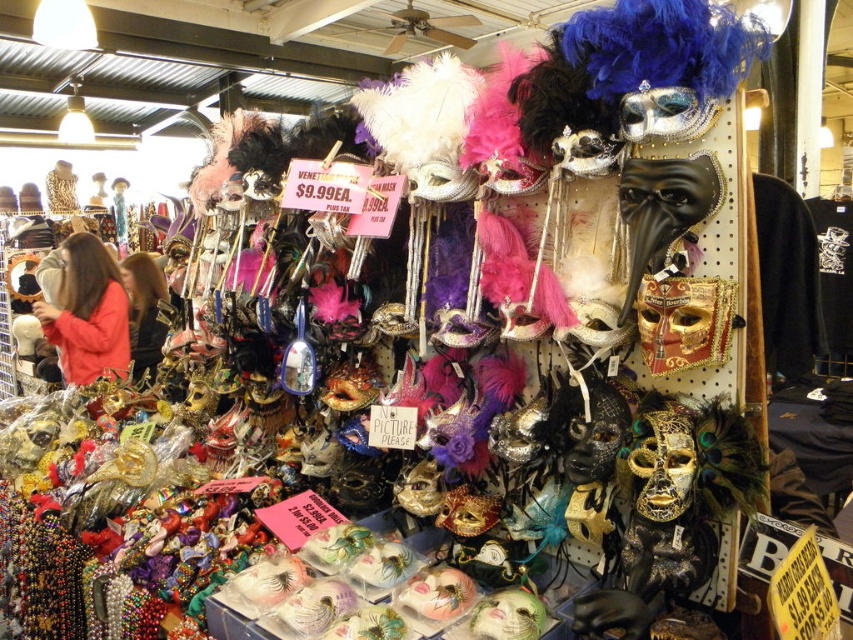
You are a customer at the market stall and want to buy two masks. The first is at point (64, 376) and the second is at point 0.622, 0.112. The stall requires that customers must be within 3 meters of an item to pick it up. Can you pick both items without moving?

The two points are 3.65 meters apart. Since the required distance to pick up an item is within 3 meters, and you can only stay in one place, you cannot be within 3 meters of both items simultaneously. Therefore, you cannot pick both items without moving.

You are shopping at a Venetian mask market and want to hang a matte pink mask at upper left above a dark brown leather jacket at center. Is the mask taller than the jacket?

The matte pink mask at upper left has a greater height compared to dark brown leather jacket at center, so yes, the matte pink mask at upper left is taller than the dark brown leather jacket at center.